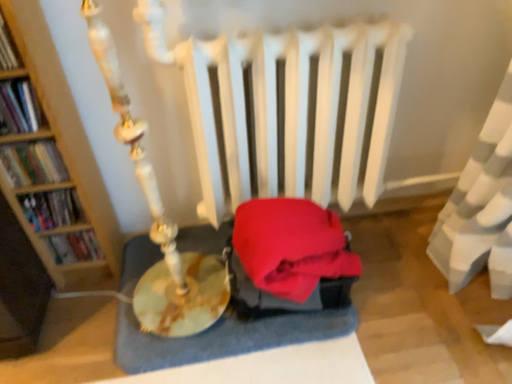
Question: Is hardcover book at left, positioned as the 2th book in bottom-to-top order, completely or partially outside of velvet red cushion at center?

Choices:
 (A) yes
 (B) no

Answer: (A)

Question: Can you confirm if hardcover book at left, positioned as the 2th book in bottom-to-top order, is shorter than velvet red cushion at center?

Choices:
 (A) yes
 (B) no

Answer: (B)

Question: Considering the relative sizes of hardcover book at left, positioned as the 2th book in bottom-to-top order, and velvet red cushion at center in the image provided, is hardcover book at left, positioned as the 2th book in bottom-to-top order, thinner than velvet red cushion at center?

Choices:
 (A) yes
 (B) no

Answer: (A)

Question: Is the position of hardcover book at left, positioned as the 2th book in bottom-to-top order, more distant than that of velvet red cushion at center?

Choices:
 (A) yes
 (B) no

Answer: (A)

Question: From a real-world perspective, is hardcover book at left, positioned as the 2th book in bottom-to-top order, on velvet red cushion at center?

Choices:
 (A) no
 (B) yes

Answer: (B)

Question: From a real-world perspective, is velvet red cushion at center physically located above or below wooden bookshelf at left, arranged as the 3th book when ordered from the bottom?

Choices:
 (A) below
 (B) above

Answer: (A)

Question: Is velvet red cushion at center spatially inside wooden bookshelf at left, placed as the 3th book when sorted from top to bottom, or outside of it?

Choices:
 (A) outside
 (B) inside

Answer: (A)

Question: Based on their sizes in the image, would you say velvet red cushion at center is bigger or smaller than wooden bookshelf at left, placed as the 3th book when sorted from top to bottom?

Choices:
 (A) big
 (B) small

Answer: (A)

Question: In the image, is velvet red cushion at center positioned in front of or behind wooden bookshelf at left, arranged as the 3th book when ordered from the bottom?

Choices:
 (A) front
 (B) behind

Answer: (B)

Question: Considering the positions of wooden bookshelf at left, placed as the 3th book when sorted from top to bottom, and hardcover book at left, which is the 1th book from bottom to top, in the image, is wooden bookshelf at left, placed as the 3th book when sorted from top to bottom, taller or shorter than hardcover book at left, which is the 1th book from bottom to top,?

Choices:
 (A) short
 (B) tall

Answer: (B)

Question: Is wooden bookshelf at left, placed as the 3th book when sorted from top to bottom, bigger or smaller than hardcover book at left, which is counted as the 5th book, starting from the top?

Choices:
 (A) big
 (B) small

Answer: (A)

Question: In the image, is wooden bookshelf at left, placed as the 3th book when sorted from top to bottom, positioned in front of or behind hardcover book at left, which is counted as the 5th book, starting from the top?

Choices:
 (A) behind
 (B) front

Answer: (B)

Question: Considering the relative positions of wooden bookshelf at left, arranged as the 3th book when ordered from the bottom, and hardcover book at left, which is counted as the 5th book, starting from the top, in the image provided, is wooden bookshelf at left, arranged as the 3th book when ordered from the bottom, to the left or to the right of hardcover book at left, which is counted as the 5th book, starting from the top,?

Choices:
 (A) right
 (B) left

Answer: (B)

Question: From a real-world perspective, is wooden bookshelf at left, arranged as the 3th book when ordered from the bottom, positioned above or below hardcover book at left, the 2th book in the top-to-bottom sequence?

Choices:
 (A) below
 (B) above

Answer: (A)

Question: In the image, is wooden bookshelf at left, arranged as the 3th book when ordered from the bottom, on the left side or the right side of hardcover book at left, the 4th book ordered from the bottom?

Choices:
 (A) right
 (B) left

Answer: (A)